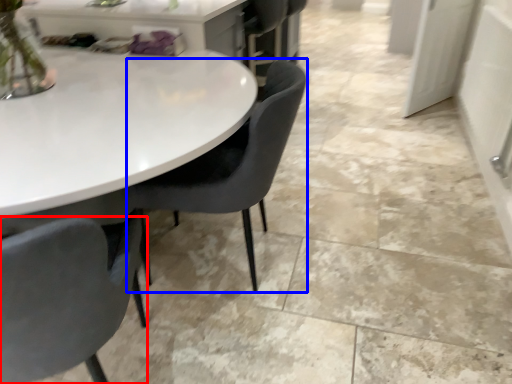
Question: Which point is closer to the camera, chair (highlighted by a red box) or chair (highlighted by a blue box)?

Choices:
 (A) chair
 (B) chair

Answer: (A)